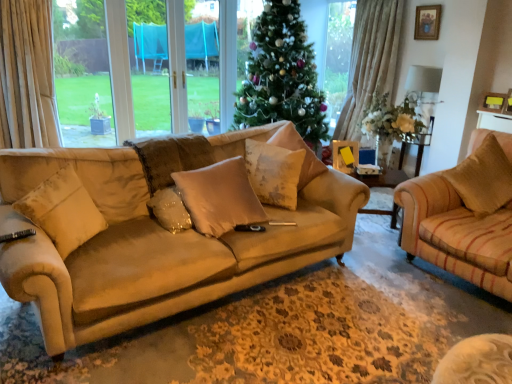
The image size is (512, 384). Identify the location of free space in front of wooden side table at center. (376, 266).